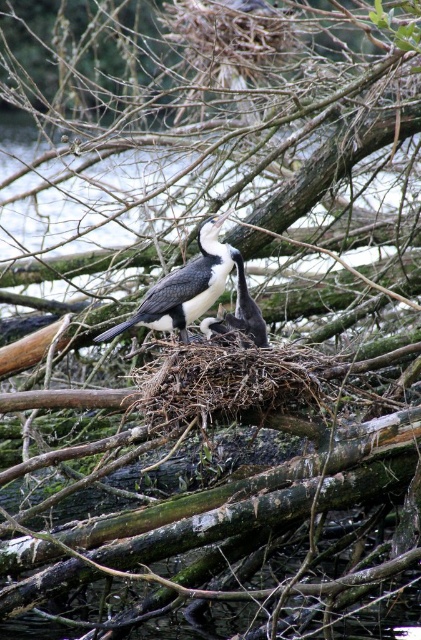
You are a wildlife photographer aiming to capture a clear photo of the white feathered bird at center. You notice that the camera lens is currently focused on the point at coordinates point (183, 288). Is the focus point correctly positioned to capture the white feathered bird at center?

Yes, the focus point at point (183, 288) is correctly positioned because the Objects Description states that this point corresponds to the white feathered bird at center.